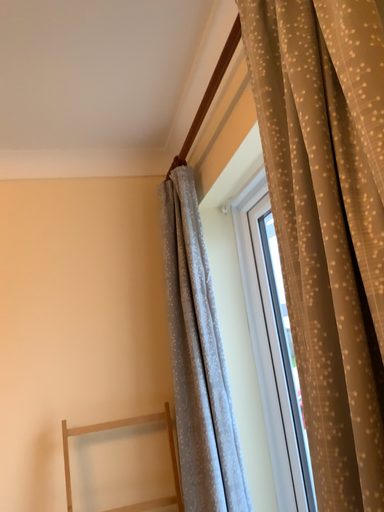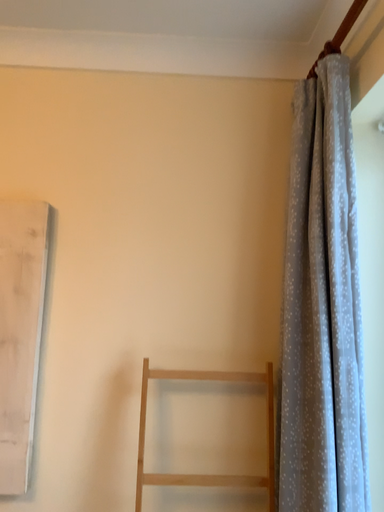
Question: How did the camera likely rotate when shooting the video?

Choices:
 (A) rotated left
 (B) rotated right

Answer: (A)